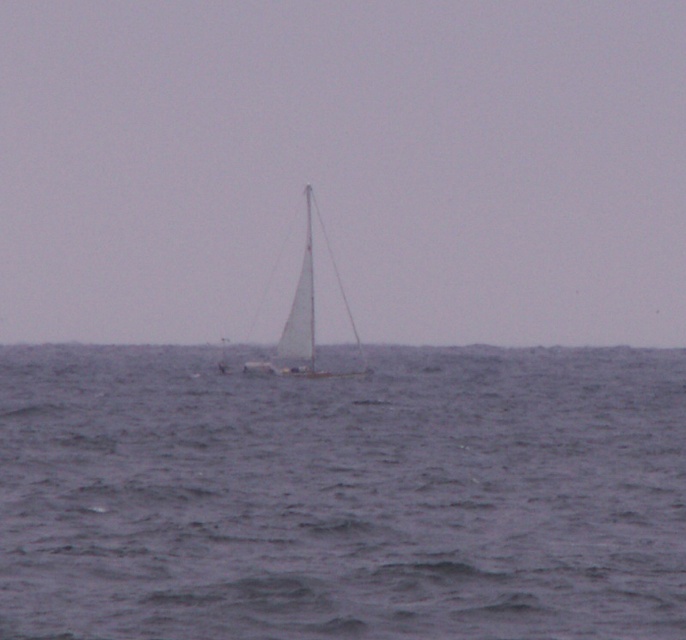
You are an observer standing on the shore looking at the gray water at center and the white sailboat at center. Which object appears wider when viewed from your position?

The gray water at center appears wider than the white sailboat at center because its width surpasses that of the sailboat.

You are an observer on the shore looking out at the gray water at center and the white sailboat at center. Which object is positioned to the right side of the other?

The gray water at center is to the right of the white sailboat at center.

You are an observer standing on the shore looking at the gray water at center and the white sailboat at center. Which object occupies a bigger area in the image?

The gray water at center has a larger size compared to the white sailboat at center, so the gray water at center occupies a bigger area in the image.